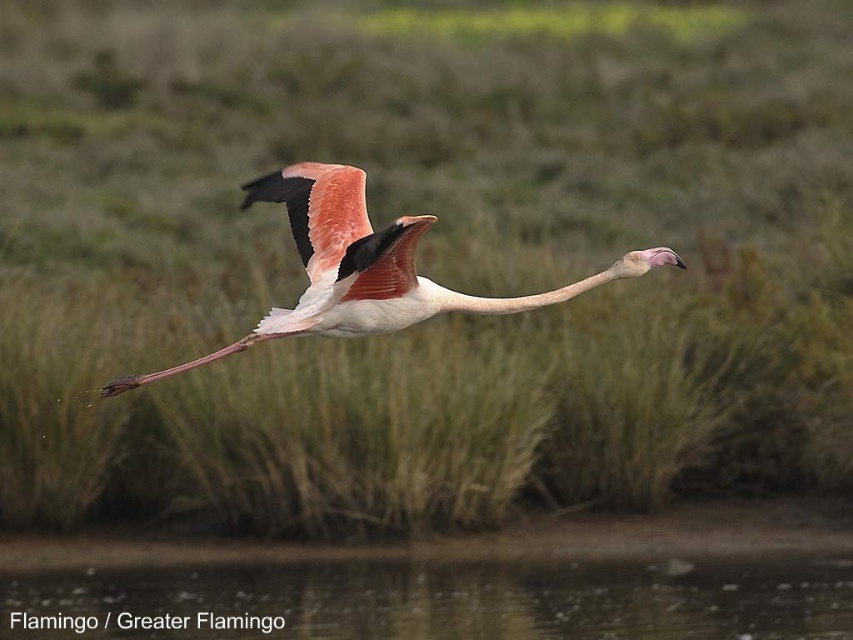
Question: In this image, where is transparent water at lower center located relative to pink feathered flamingo at center?

Choices:
 (A) left
 (B) right

Answer: (A)

Question: Among these points, which one is nearest to the camera?

Choices:
 (A) (x=206, y=632)
 (B) (x=332, y=307)

Answer: (B)

Question: Is transparent water at lower center in front of pink feathered flamingo at center?

Choices:
 (A) yes
 (B) no

Answer: (B)

Question: Is transparent water at lower center bigger than pink feathered flamingo at center?

Choices:
 (A) yes
 (B) no

Answer: (B)